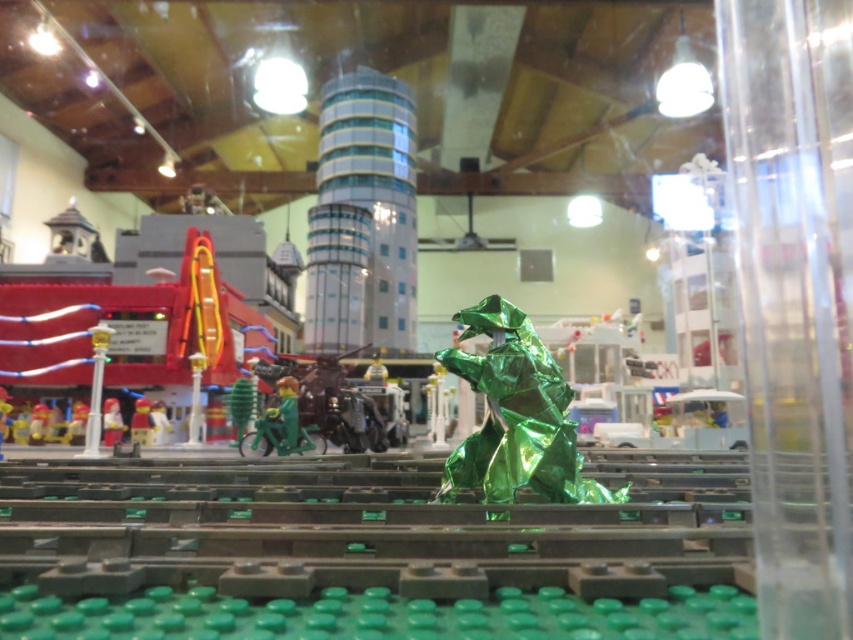
You are a visitor at the Lego exhibition and want to take a photo of the green metallic dinosaur figure on the dark gray baseplate. There is a matte red toy car at left in the scene. To ensure the car doesn not appear in your photo, where should you position yourself relative to the car?

The matte red toy car at left is located at point (111,420). To avoid including it in your photo, position yourself such that the car is outside the camera frame, likely by moving to the right side of the car or adjusting your angle to exclude its position at those coordinates.